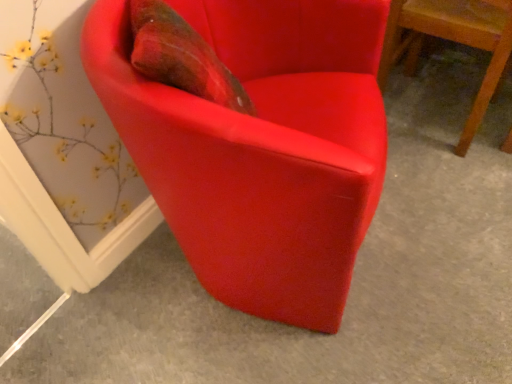
This screenshot has width=512, height=384. Describe the element at coordinates (454, 41) in the screenshot. I see `satin red armchair at lower right, acting as the first chair starting from the right` at that location.

Where is `satin red armchair at lower right, acting as the first chair starting from the right`? Image resolution: width=512 pixels, height=384 pixels. satin red armchair at lower right, acting as the first chair starting from the right is located at coordinates (454, 41).

Describe the element at coordinates (260, 147) in the screenshot. The height and width of the screenshot is (384, 512). I see `satin red armchair at center, which ranks as the 1th chair in left-to-right order` at that location.

Find the location of `satin red armchair at center, positioned as the second chair in right-to-left order`. satin red armchair at center, positioned as the second chair in right-to-left order is located at coordinates (260, 147).

Where is `satin red armchair at lower right, acting as the 2th chair starting from the left`? satin red armchair at lower right, acting as the 2th chair starting from the left is located at coordinates (454, 41).

Can you confirm if satin red armchair at center, positioned as the second chair in right-to-left order, is positioned to the left of satin red armchair at lower right, acting as the first chair starting from the right?

Yes.

From the picture: Which is in front, satin red armchair at center, positioned as the second chair in right-to-left order, or satin red armchair at lower right, acting as the 2th chair starting from the left?

satin red armchair at center, positioned as the second chair in right-to-left order, is more forward.

Which is nearer, (312, 28) or (462, 32)?

The point (312, 28) is closer to the camera.

From the image's perspective, would you say satin red armchair at center, which ranks as the 1th chair in left-to-right order, is shown under satin red armchair at lower right, acting as the first chair starting from the right?

Indeed, from the image's perspective, satin red armchair at center, which ranks as the 1th chair in left-to-right order, is shown beneath satin red armchair at lower right, acting as the first chair starting from the right.

From a real-world perspective, relative to satin red armchair at lower right, acting as the 2th chair starting from the left, is satin red armchair at center, positioned as the second chair in right-to-left order, vertically above or below?

satin red armchair at center, positioned as the second chair in right-to-left order, is situated higher than satin red armchair at lower right, acting as the 2th chair starting from the left, in the real world.

Between satin red armchair at center, positioned as the second chair in right-to-left order, and satin red armchair at lower right, acting as the first chair starting from the right, which one has smaller width?

Thinner between the two is satin red armchair at lower right, acting as the first chair starting from the right.

Considering the relative sizes of satin red armchair at center, which ranks as the 1th chair in left-to-right order, and satin red armchair at lower right, acting as the first chair starting from the right, in the image provided, is satin red armchair at center, which ranks as the 1th chair in left-to-right order, shorter than satin red armchair at lower right, acting as the first chair starting from the right,?

In fact, satin red armchair at center, which ranks as the 1th chair in left-to-right order, may be taller than satin red armchair at lower right, acting as the first chair starting from the right.

Considering the relative sizes of satin red armchair at center, positioned as the second chair in right-to-left order, and satin red armchair at lower right, acting as the first chair starting from the right, in the image provided, is satin red armchair at center, positioned as the second chair in right-to-left order, smaller than satin red armchair at lower right, acting as the first chair starting from the right,?

Incorrect, satin red armchair at center, positioned as the second chair in right-to-left order, is not smaller in size than satin red armchair at lower right, acting as the first chair starting from the right.

Would you say satin red armchair at lower right, acting as the first chair starting from the right, is part of satin red armchair at center, positioned as the second chair in right-to-left order,'s contents?

No, satin red armchair at lower right, acting as the first chair starting from the right, is not surrounded by satin red armchair at center, positioned as the second chair in right-to-left order.

Is satin red armchair at center, which ranks as the 1th chair in left-to-right order, touching satin red armchair at lower right, acting as the first chair starting from the right?

No, satin red armchair at center, which ranks as the 1th chair in left-to-right order, is not in contact with satin red armchair at lower right, acting as the first chair starting from the right.

Is satin red armchair at center, which ranks as the 1th chair in left-to-right order, facing towards satin red armchair at lower right, acting as the 2th chair starting from the left?

No.

Can you tell me how much satin red armchair at center, which ranks as the 1th chair in left-to-right order, and satin red armchair at lower right, acting as the 2th chair starting from the left, differ in facing direction?

67.8 degrees separate the facing orientations of satin red armchair at center, which ranks as the 1th chair in left-to-right order, and satin red armchair at lower right, acting as the 2th chair starting from the left.

Measure the distance between satin red armchair at center, positioned as the second chair in right-to-left order, and satin red armchair at lower right, acting as the first chair starting from the right.

satin red armchair at center, positioned as the second chair in right-to-left order, is 23.18 inches away from satin red armchair at lower right, acting as the first chair starting from the right.

The width and height of the screenshot is (512, 384). What are the coordinates of `chair that is on the left side of satin red armchair at lower right, acting as the first chair starting from the right` in the screenshot? It's located at (260, 147).

Which is more to the left, satin red armchair at lower right, acting as the 2th chair starting from the left, or satin red armchair at center, positioned as the second chair in right-to-left order?

From the viewer's perspective, satin red armchair at center, positioned as the second chair in right-to-left order, appears more on the left side.

Is satin red armchair at lower right, acting as the first chair starting from the right, in front of or behind satin red armchair at center, positioned as the second chair in right-to-left order, in the image?

Clearly, satin red armchair at lower right, acting as the first chair starting from the right, is behind satin red armchair at center, positioned as the second chair in right-to-left order.

Does point (489, 22) come in front of point (240, 194)?

That is False.

From the image's perspective, is satin red armchair at lower right, acting as the first chair starting from the right, beneath satin red armchair at center, which ranks as the 1th chair in left-to-right order?

Actually, satin red armchair at lower right, acting as the first chair starting from the right, appears above satin red armchair at center, which ranks as the 1th chair in left-to-right order, in the image.

From a real-world perspective, relative to satin red armchair at center, positioned as the second chair in right-to-left order, is satin red armchair at lower right, acting as the 2th chair starting from the left, vertically above or below?

In terms of real-world spatial position, satin red armchair at lower right, acting as the 2th chair starting from the left, is below satin red armchair at center, positioned as the second chair in right-to-left order.

Considering the relative sizes of satin red armchair at lower right, acting as the first chair starting from the right, and satin red armchair at center, which ranks as the 1th chair in left-to-right order, in the image provided, is satin red armchair at lower right, acting as the first chair starting from the right, thinner than satin red armchair at center, which ranks as the 1th chair in left-to-right order,?

Yes.

Which of these two, satin red armchair at lower right, acting as the 2th chair starting from the left, or satin red armchair at center, which ranks as the 1th chair in left-to-right order, stands taller?

satin red armchair at center, which ranks as the 1th chair in left-to-right order.

Does satin red armchair at lower right, acting as the first chair starting from the right, have a smaller size compared to satin red armchair at center, which ranks as the 1th chair in left-to-right order?

Correct, satin red armchair at lower right, acting as the first chair starting from the right, occupies less space than satin red armchair at center, which ranks as the 1th chair in left-to-right order.

Is satin red armchair at lower right, acting as the 2th chair starting from the left, located outside satin red armchair at center, positioned as the second chair in right-to-left order?

Yes, satin red armchair at lower right, acting as the 2th chair starting from the left, is not within satin red armchair at center, positioned as the second chair in right-to-left order.

Is satin red armchair at lower right, acting as the 2th chair starting from the left, with satin red armchair at center, which ranks as the 1th chair in left-to-right order?

No, satin red armchair at lower right, acting as the 2th chair starting from the left, is not next to satin red armchair at center, which ranks as the 1th chair in left-to-right order.

Is satin red armchair at lower right, acting as the first chair starting from the right, facing away from satin red armchair at center, which ranks as the 1th chair in left-to-right order?

Yes.

Can you tell me how much satin red armchair at lower right, acting as the 2th chair starting from the left, and satin red armchair at center, positioned as the second chair in right-to-left order, differ in facing direction?

There is a 67.8-degree angle between the facing directions of satin red armchair at lower right, acting as the 2th chair starting from the left, and satin red armchair at center, positioned as the second chair in right-to-left order.

Locate an element on the screen. chair lying on the left of satin red armchair at lower right, acting as the first chair starting from the right is located at coordinates (260, 147).

Locate an element on the screen. This screenshot has height=384, width=512. chair on the right of the satin red armchair at center, which ranks as the 1th chair in left-to-right order is located at coordinates (454, 41).

Identify the location of chair below the satin red armchair at lower right, acting as the first chair starting from the right (from the image's perspective). (260, 147).